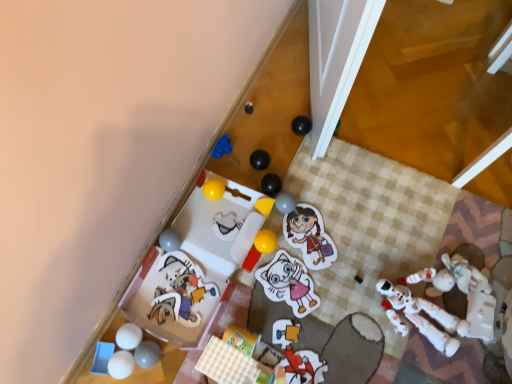
At what (x,y) coordinates should I click in order to perform the action: click on free space to the left of white rubber ball at lower left, which appears as the second toy when viewed from the left. Please return your answer as a coordinate pair (x, y). The width and height of the screenshot is (512, 384). Looking at the image, I should click on (94, 360).